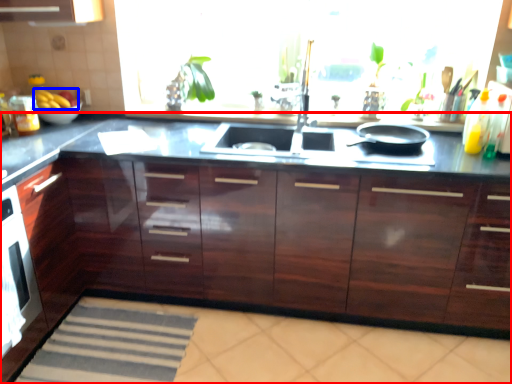
Question: Which object is closer to the camera taking this photo, countertop (highlighted by a red box) or fruit (highlighted by a blue box)?

Choices:
 (A) countertop
 (B) fruit

Answer: (A)